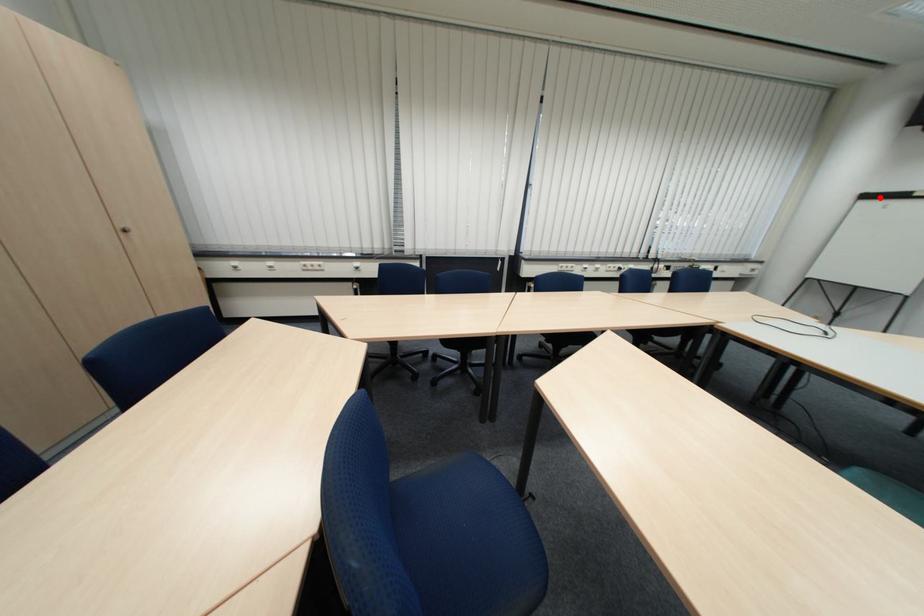
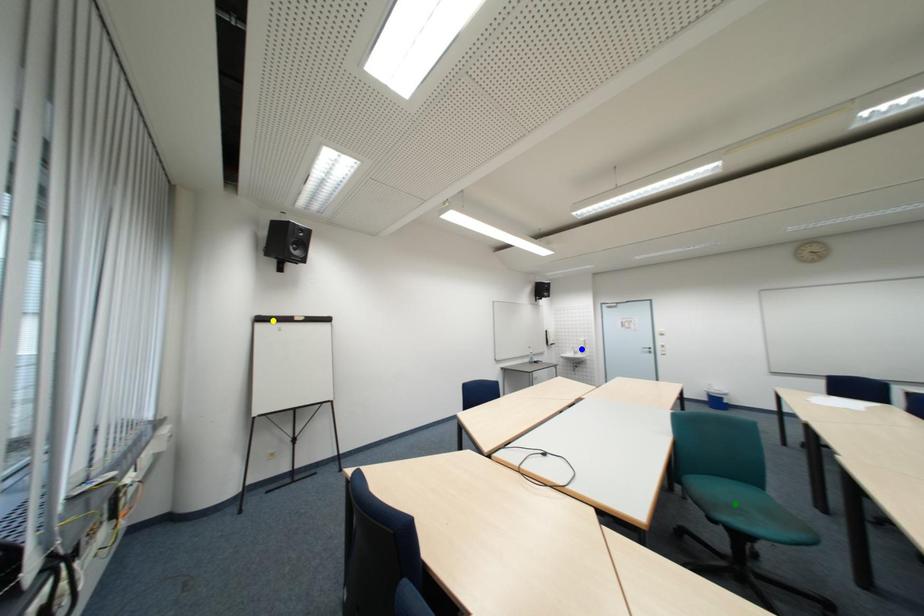
Question: I am providing you with two images of the same scene from different viewpoints. A red point is marked on the first image. You are given multiple points on the second image. Which point in image 2 is actually the same real-world point as the red point in image 1?

Choices:
 (A) blue point
 (B) green point
 (C) yellow point

Answer: (C)